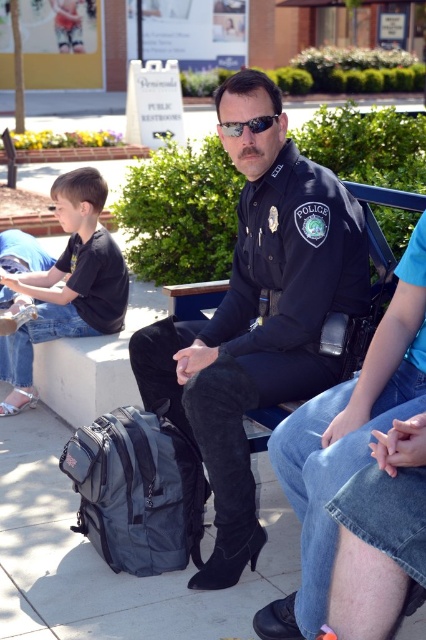
You are a fashion designer analyzing the image. Which object in the scene has a larger size between the dark blue uniform at center and the black reflective sunglasses at center?

The dark blue uniform at center is bigger than the black reflective sunglasses at center according to the description provided.

Based on the scene description, where is the dark blue uniform at center located in terms of its 2D coordinates?

The dark blue uniform at center is located at the 2D coordinates of point (258, 316).